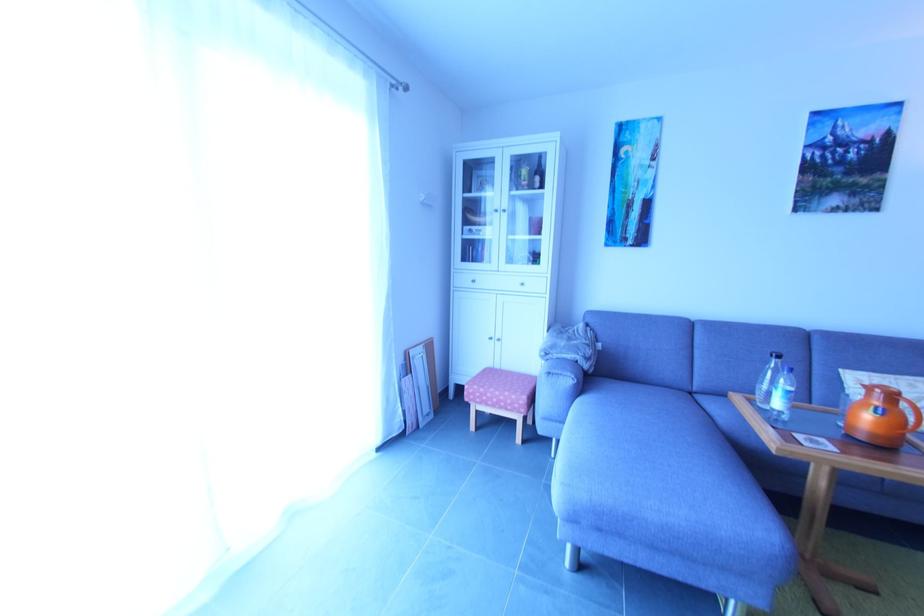
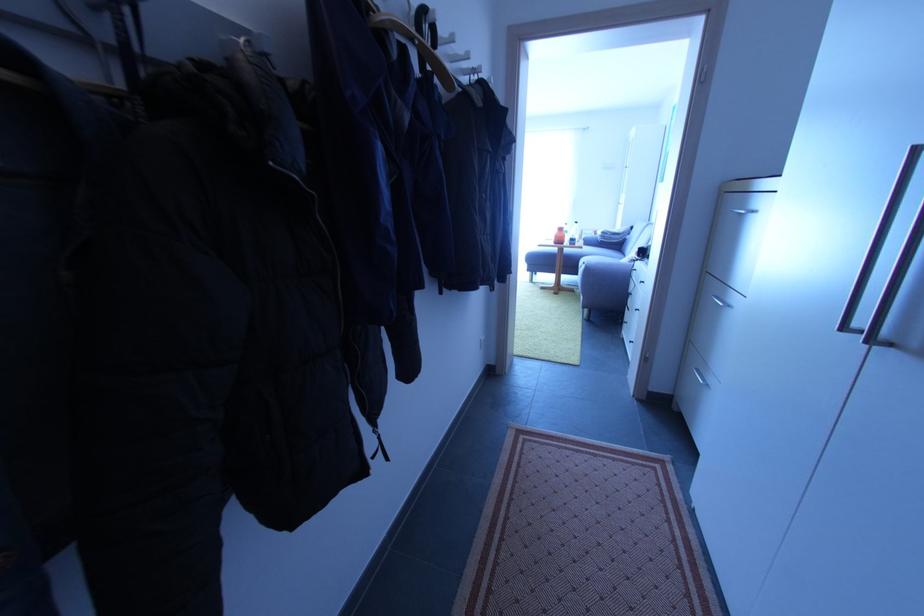
In the second image, find the point that corresponds to point (411, 371) in the first image.

(585, 238)